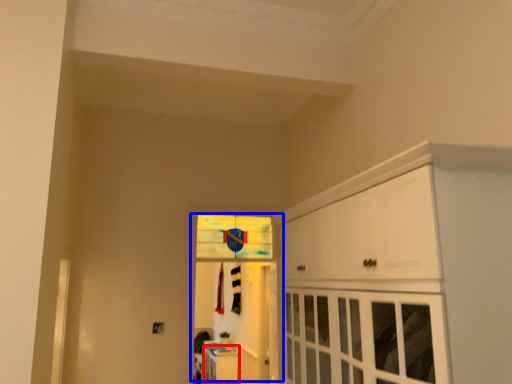
Question: Which point is further to the camera, cabinetry (highlighted by a red box) or door (highlighted by a blue box)?

Choices:
 (A) cabinetry
 (B) door

Answer: (A)